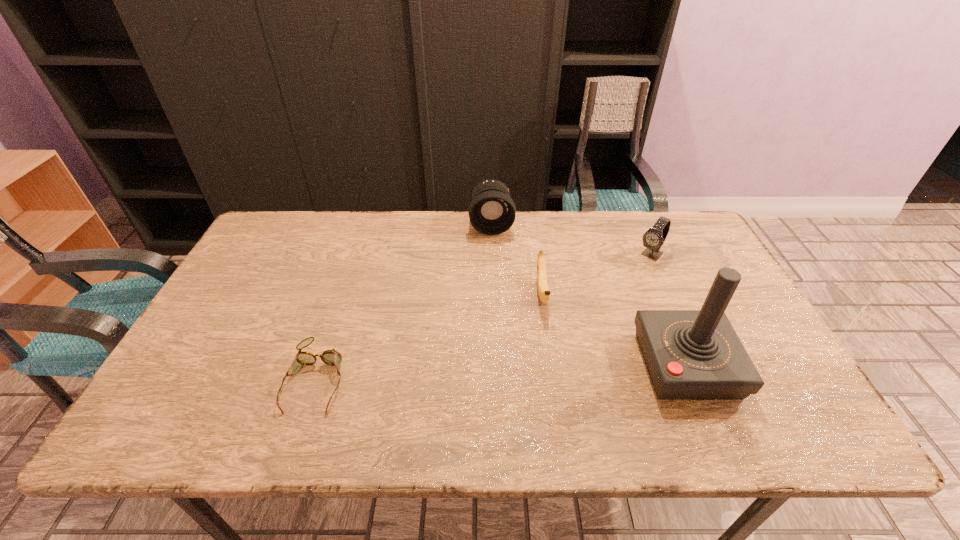
At what (x,y) coordinates should I click in order to perform the action: click on vacant space situated on the face of the watch. Please return your answer as a coordinate pair (x, y). Looking at the image, I should click on (588, 324).

Locate an element on the screen. The image size is (960, 540). vacant space located 0.250m on the face of the watch is located at coordinates (603, 307).

Where is `vacant region located on the face of the watch`? This screenshot has width=960, height=540. vacant region located on the face of the watch is located at coordinates (582, 330).

In order to click on free space located at the front element of the fourth shortest object in this screenshot , I will do [494, 258].

Where is `free space located 0.080m at the front element of the fourth shortest object`? This screenshot has width=960, height=540. free space located 0.080m at the front element of the fourth shortest object is located at coordinates (493, 252).

This screenshot has height=540, width=960. What are the coordinates of `vacant space situated 0.270m at the front element of the fourth shortest object` in the screenshot? It's located at (496, 294).

Locate an element on the screen. free space located 0.180m at the stem of the third object from right to left is located at coordinates (553, 374).

Identify the location of vacant region located at the stem of the third object from right to left. (548, 341).

Where is `vacant space positioned at the stem of the third object from right to left`? The width and height of the screenshot is (960, 540). vacant space positioned at the stem of the third object from right to left is located at coordinates (553, 381).

Where is `watch positioned at the far edge`? The image size is (960, 540). watch positioned at the far edge is located at coordinates (654, 237).